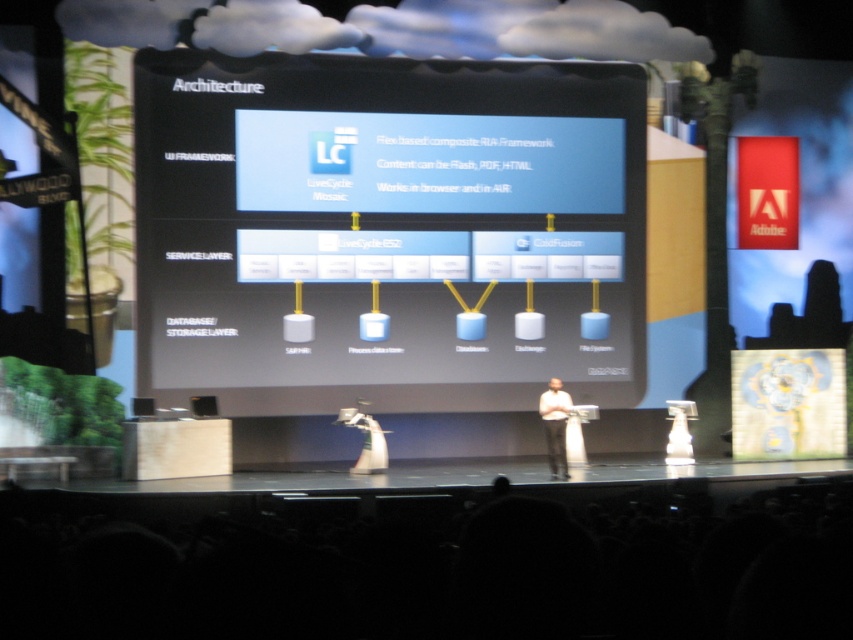
Question: Does white fabric dress at center appear over black plastic speaker at lower left?

Choices:
 (A) no
 (B) yes

Answer: (A)

Question: Among these objects, which one is nearest to the camera?

Choices:
 (A) white shirt at center
 (B) black plastic speaker at lower left
 (C) black matte screen at center
 (D) matte black speaker at center

Answer: (A)

Question: Can you confirm if white fabric dress at center is bigger than matte black speaker at center?

Choices:
 (A) no
 (B) yes

Answer: (B)

Question: Which point is farther to the camera?

Choices:
 (A) (x=148, y=401)
 (B) (x=218, y=412)

Answer: (B)

Question: Which point appears closest to the camera in this image?

Choices:
 (A) click(x=370, y=372)
 (B) click(x=143, y=406)
 (C) click(x=381, y=449)
 (D) click(x=548, y=436)

Answer: (B)

Question: Is the position of black matte screen at center more distant than that of matte black speaker at center?

Choices:
 (A) no
 (B) yes

Answer: (B)